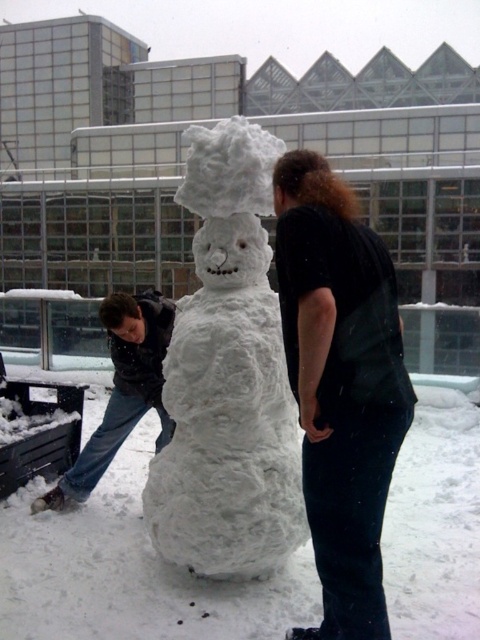
You are trying to decide which clothing item to wear for a winter activity. You see the black matte vest at center and the dark gray jacket at left in the image. Which one is smaller in size?

The black matte vest at center is smaller in size than the dark gray jacket at left since it occupies less space.

You are trying to decide whether to place a large red scarf on the white fluffy snowman at center or the dark gray jacket at left. Based on their widths, which one would the scarf fit better on?

The dark gray jacket at left is wider than the white fluffy snowman at center, so the large red scarf would fit better on the dark gray jacket at left.